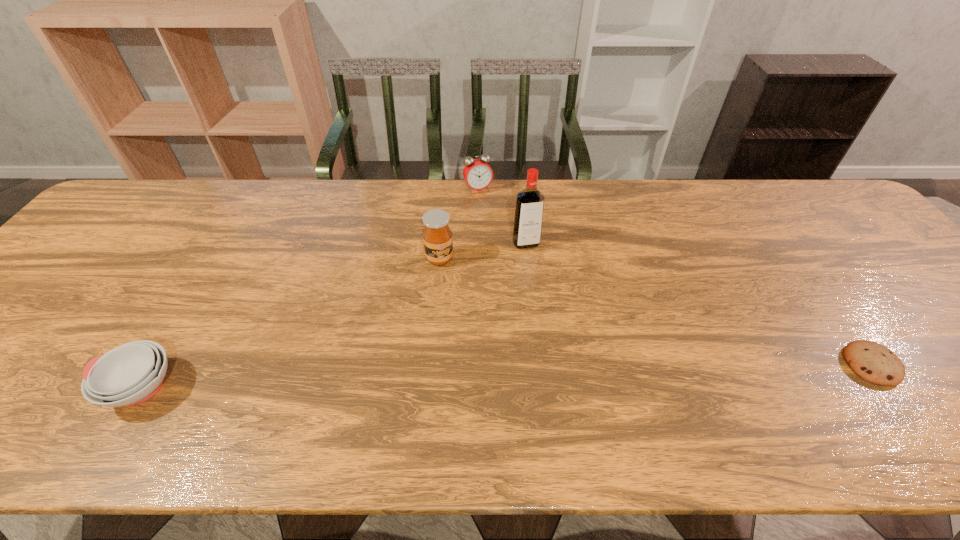
You are a GUI agent. You are given a task and a screenshot of the screen. Output one action in this format:
    pyautogui.click(x=<x>, y=<y>)
    Task: Click on the free point between the soup bowl and the tallest object
    
    Given the screenshot: What is the action you would take?
    pyautogui.click(x=333, y=315)

Identify the location of free area in between the farthest object and the second object from left to right. (459, 224).

Where is `empty space that is in between the vodka and the second tallest object`? empty space that is in between the vodka and the second tallest object is located at coordinates (483, 251).

Locate an element on the screen. free spot between the fourth shortest object and the cookie is located at coordinates (656, 312).

This screenshot has width=960, height=540. I want to click on empty space that is in between the alarm clock and the cookie, so click(x=675, y=277).

You are a GUI agent. You are given a task and a screenshot of the screen. Output one action in this format:
    pyautogui.click(x=<x>, y=<y>)
    Task: Click on the vacant point located between the shortest object and the fourth tallest object
    
    Given the screenshot: What is the action you would take?
    pyautogui.click(x=506, y=376)

Where is `vacant space that's between the second tallest object and the soup bowl`? vacant space that's between the second tallest object and the soup bowl is located at coordinates (289, 323).

At what (x,y) coordinates should I click in order to perform the action: click on unoccupied area between the cookie and the fourth object from left to right. Please return your answer as a coordinate pair (x, y). This screenshot has height=540, width=960. Looking at the image, I should click on (699, 304).

Identify which object is the second closest to the alarm clock. Please provide its 2D coordinates. Your answer should be formatted as a tuple, i.e. [(x, y)], where the tuple contains the x and y coordinates of a point satisfying the conditions above.

[(437, 236)]

The width and height of the screenshot is (960, 540). I want to click on the third closest object to the second shortest object, so click(478, 175).